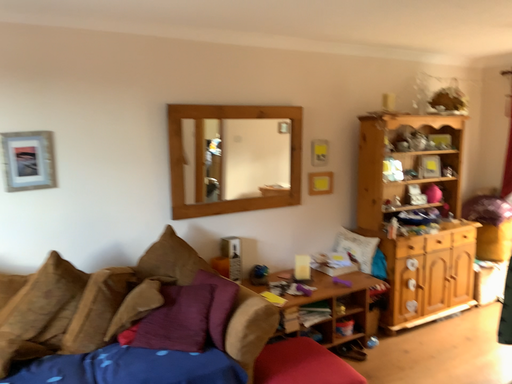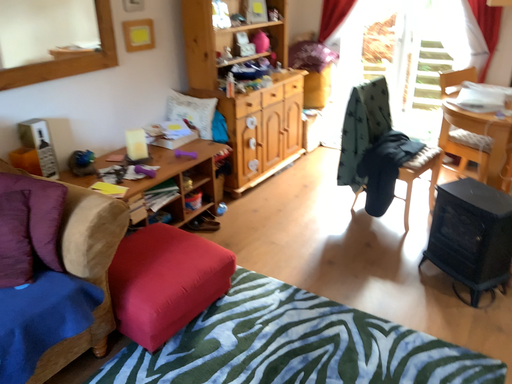
Question: Which way did the camera rotate in the video?

Choices:
 (A) rotated upward
 (B) rotated downward

Answer: (B)